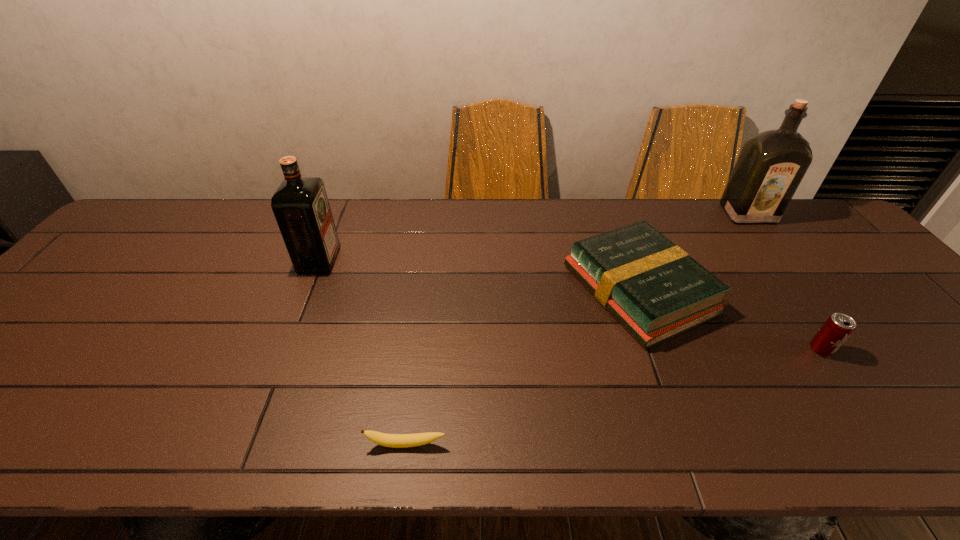
The height and width of the screenshot is (540, 960). I want to click on object that stands as the third closest to the shortest object, so click(838, 327).

Where is `object that is the second closest to the farther liquor`? The image size is (960, 540). object that is the second closest to the farther liquor is located at coordinates (838, 327).

Where is `vacant area in the image that satisfies the following two spatial constraints: 1. on the front label of the left liquor; 2. on the left side of the beer can`? vacant area in the image that satisfies the following two spatial constraints: 1. on the front label of the left liquor; 2. on the left side of the beer can is located at coordinates (282, 349).

The image size is (960, 540). I want to click on vacant space that satisfies the following two spatial constraints: 1. on the front label of the shorter liquor; 2. on the left side of the beer can, so click(x=282, y=349).

Find the location of a particular element. This screenshot has width=960, height=540. blank area in the image that satisfies the following two spatial constraints: 1. on the front label of the leftmost object; 2. on the back side of the third object from left to right is located at coordinates (307, 289).

The width and height of the screenshot is (960, 540). Find the location of `vacant point that satisfies the following two spatial constraints: 1. on the label of the right liquor; 2. on the front label of the nearer liquor`. vacant point that satisfies the following two spatial constraints: 1. on the label of the right liquor; 2. on the front label of the nearer liquor is located at coordinates [783, 260].

The width and height of the screenshot is (960, 540). In order to click on free space that satisfies the following two spatial constraints: 1. on the front label of the fourth shortest object; 2. on the right side of the beer can in this screenshot , I will do `click(282, 349)`.